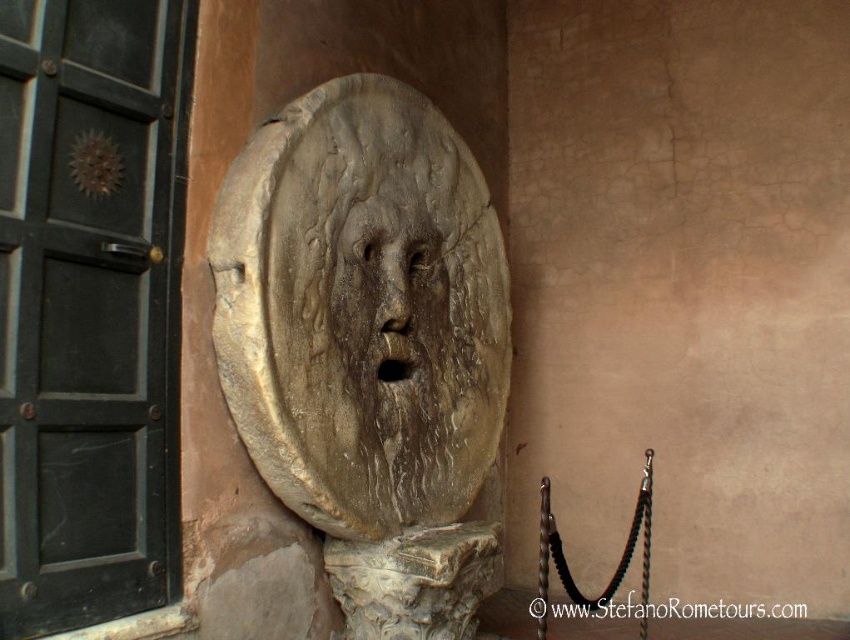
Question: Can you confirm if brown stone mask at center is positioned to the left of rough stone face at center?

Choices:
 (A) no
 (B) yes

Answer: (A)

Question: Where is brown stone mask at center located in relation to rough stone face at center in the image?

Choices:
 (A) above
 (B) below

Answer: (B)

Question: Which point is farther to the camera?

Choices:
 (A) (370, 204)
 (B) (412, 604)

Answer: (A)

Question: Considering the relative positions of brown stone mask at center and rough stone face at center in the image provided, where is brown stone mask at center located with respect to rough stone face at center?

Choices:
 (A) right
 (B) left

Answer: (A)